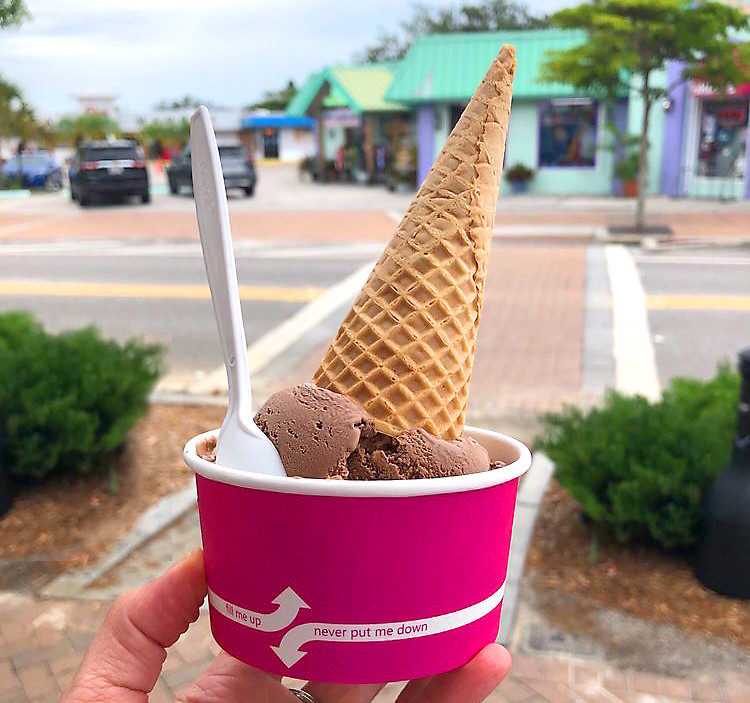
The width and height of the screenshot is (750, 703). Find the location of `windows`. windows is located at coordinates (573, 133), (723, 148).